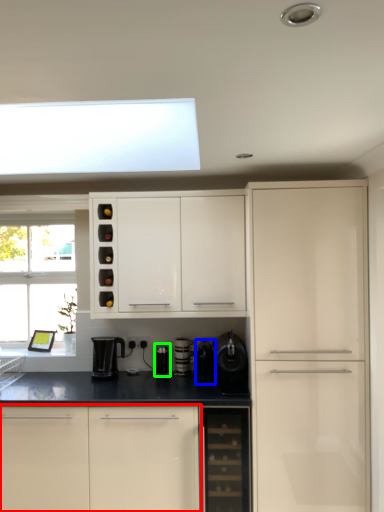
Question: Which object is positioned farthest from cabinetry (highlighted by a red box)? Select from appliance (highlighted by a blue box) and appliance (highlighted by a green box).

Choices:
 (A) appliance
 (B) appliance

Answer: (B)